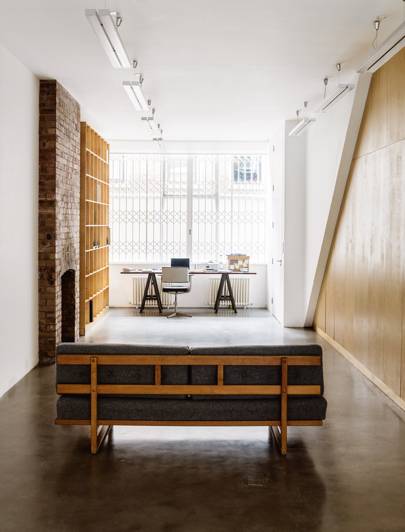
Locate an element on the screen. This screenshot has width=405, height=532. box on desk is located at coordinates (234, 259).